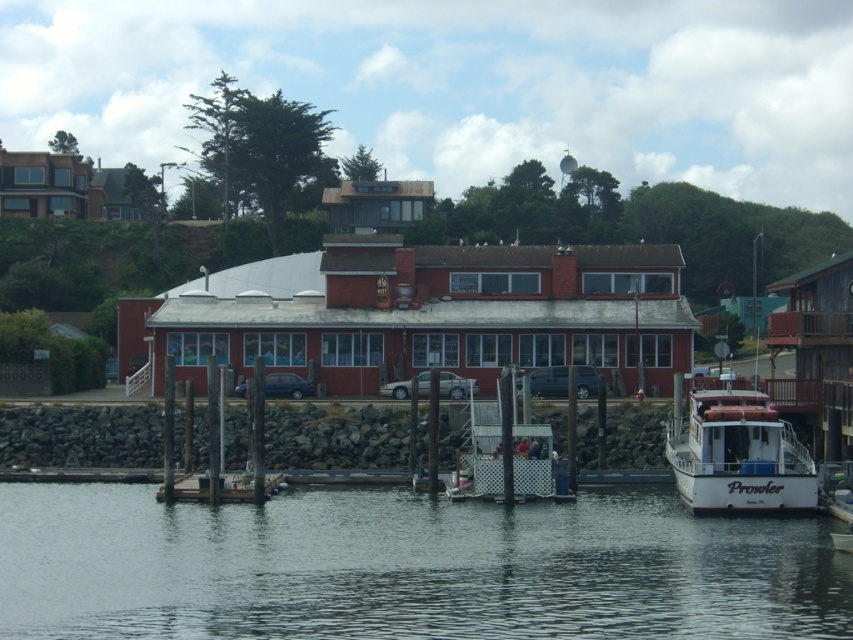
Who is positioned more to the right, transparent water at lower center or white matte boat at lower right?

Positioned to the right is white matte boat at lower right.

Measure the distance between transparent water at lower center and camera.

They are 94.29 feet apart.

The height and width of the screenshot is (640, 853). What do you see at coordinates (407, 566) in the screenshot?
I see `transparent water at lower center` at bounding box center [407, 566].

The width and height of the screenshot is (853, 640). I want to click on transparent water at lower center, so click(x=407, y=566).